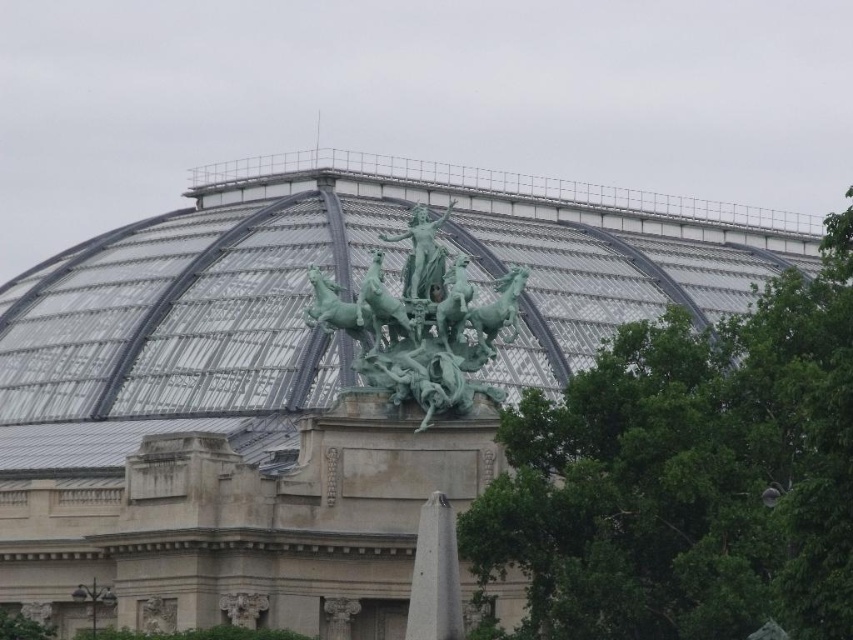
You are an art conservator assessing two statues in the center of the dome structure. The statues are labeled as the green patina statue at center and the green polished stone statue at center. Which statue has a greater width?

The green patina statue at center has a greater width than the green polished stone statue at center according to the description provided.